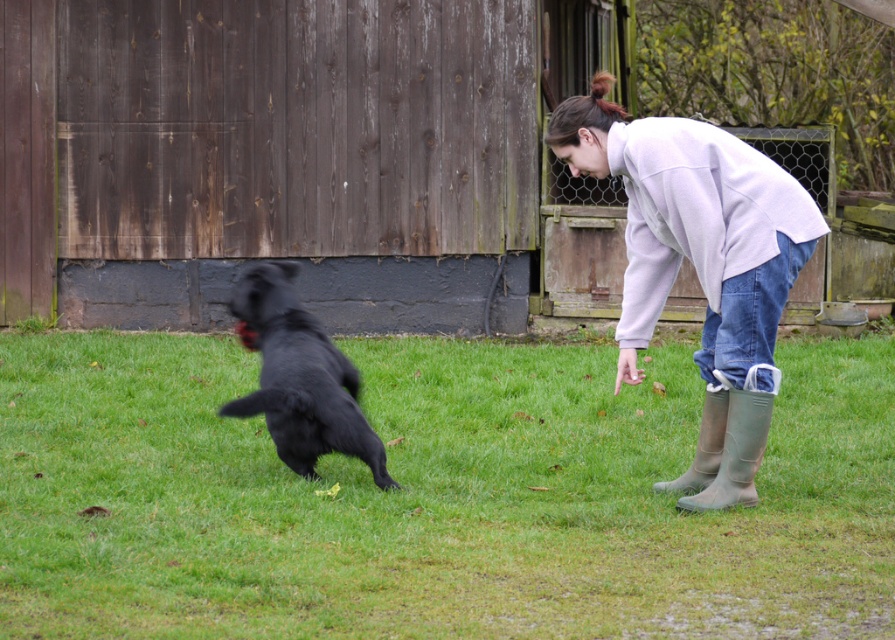
Is shiny black dog at center closer to camera compared to rubber boots at lower right?

Yes.

Who is more distant from viewer, (x=271, y=308) or (x=726, y=392)?

The point (x=271, y=308) is behind.

What are the coordinates of `shiny black dog at center` in the screenshot? It's located at point(299,376).

Measure the distance from green grass at lower center to light purple fleece at center.

green grass at lower center and light purple fleece at center are 1.72 meters apart from each other.

Is point (391, 392) less distant than point (721, 333)?

No, (391, 392) is further to viewer.

Locate an element on the screen. Image resolution: width=895 pixels, height=640 pixels. green grass at lower center is located at coordinates (433, 497).

Is light purple fleece at center shorter than rubber boots at lower right?

No.

Can you confirm if light purple fleece at center is positioned below rubber boots at lower right?

Actually, light purple fleece at center is above rubber boots at lower right.

Where is `light purple fleece at center`? light purple fleece at center is located at coordinates (699, 266).